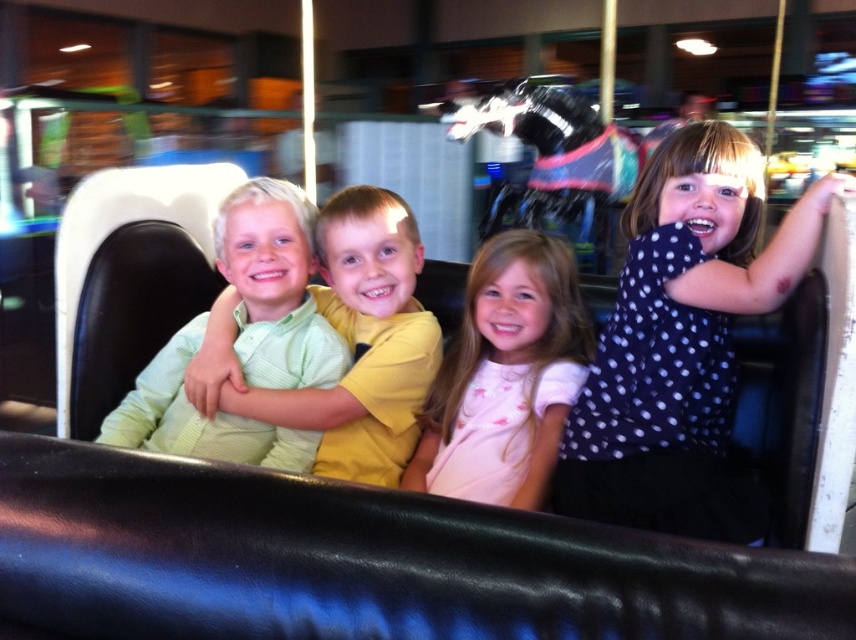
Question: Does polka dot blouse at upper right appear over light green knitted sweater at center?

Choices:
 (A) no
 (B) yes

Answer: (A)

Question: Which of the following is the closest to the observer?

Choices:
 (A) polka dot blouse at upper right
 (B) pink cotton shirt at center
 (C) light green knitted sweater at center
 (D) green textured shirt at center

Answer: (A)

Question: Is polka dot blouse at upper right above green textured shirt at center?

Choices:
 (A) no
 (B) yes

Answer: (A)

Question: Based on their relative distances, which object is nearer to the green textured shirt at center?

Choices:
 (A) polka dot blouse at upper right
 (B) light green knitted sweater at center

Answer: (B)

Question: Does pink cotton shirt at center have a greater width compared to light green knitted sweater at center?

Choices:
 (A) no
 (B) yes

Answer: (A)

Question: Considering the real-world distances, which object is farthest from the light green knitted sweater at center?

Choices:
 (A) polka dot blouse at upper right
 (B) green textured shirt at center

Answer: (A)